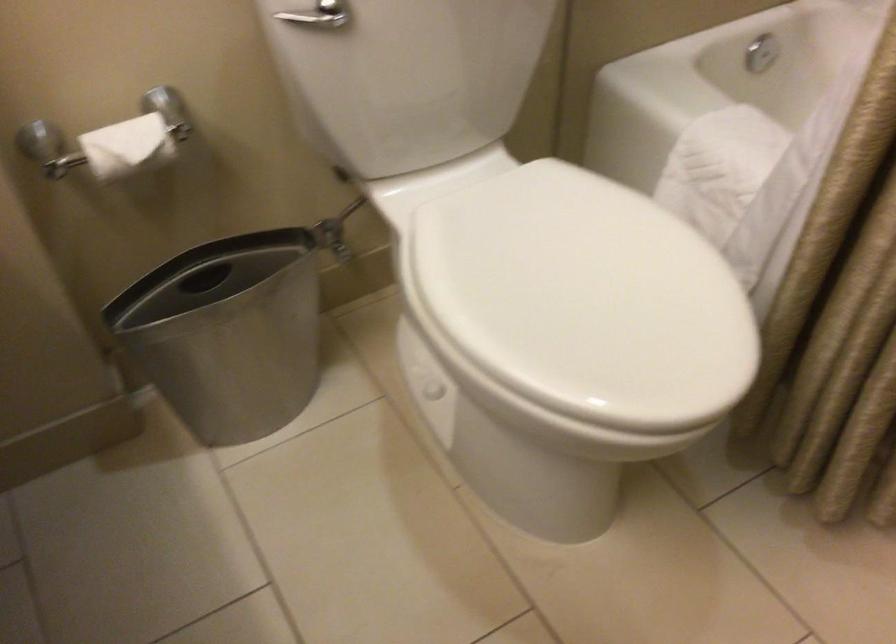
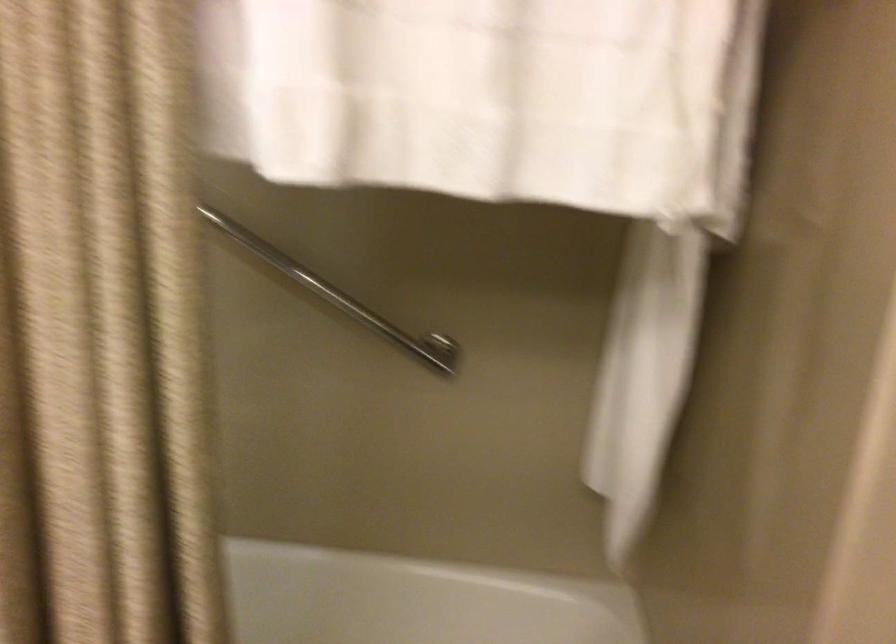
Question: The camera is either moving clockwise (left) or counter-clockwise (right) around the object. The first image is from the beginning of the video and the second image is from the end. Is the camera moving left or right when shooting the video?

Choices:
 (A) Left
 (B) Right

Answer: (A)